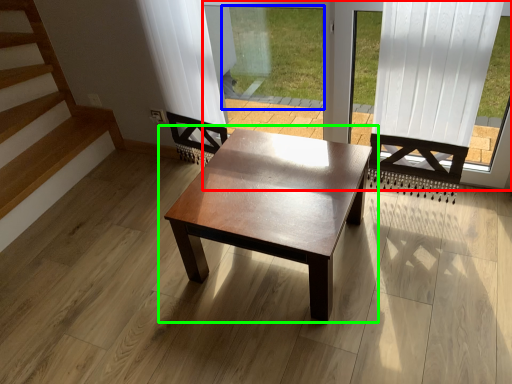
Question: Which object is the farthest from window frame (highlighted by a red box)? Choose among these: window screen (highlighted by a blue box) or coffee table (highlighted by a green box).

Choices:
 (A) window screen
 (B) coffee table

Answer: (B)